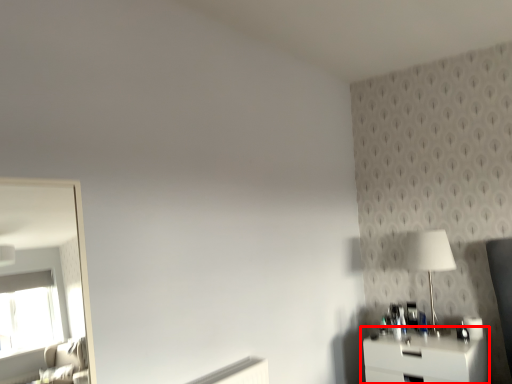
Question: Observing the image, what is the correct spatial positioning of nightstand (annotated by the red box) in reference to table lamp?

Choices:
 (A) left
 (B) right

Answer: (A)